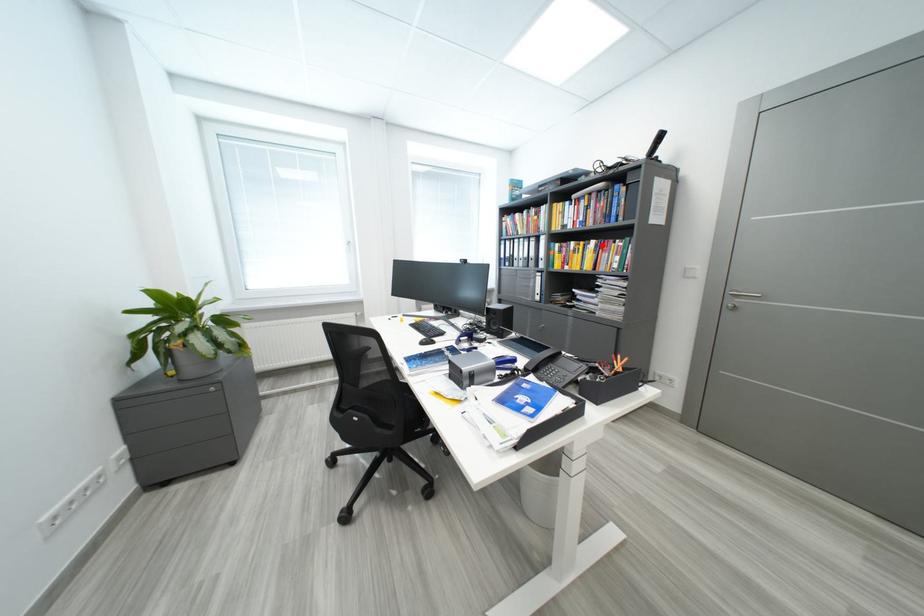
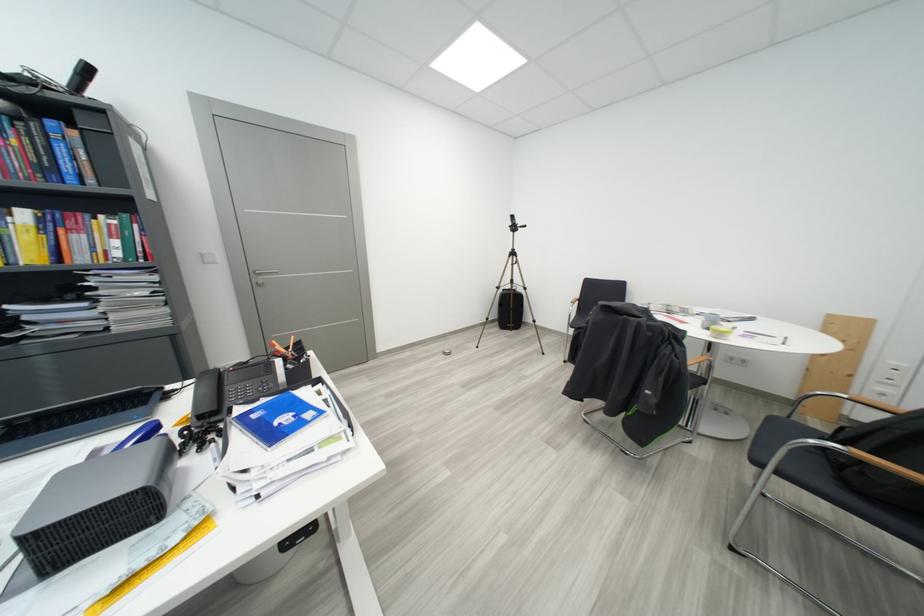
The point at the highlighted location is marked in the first image. Where is the corresponding point in the second image?

(32, 216)